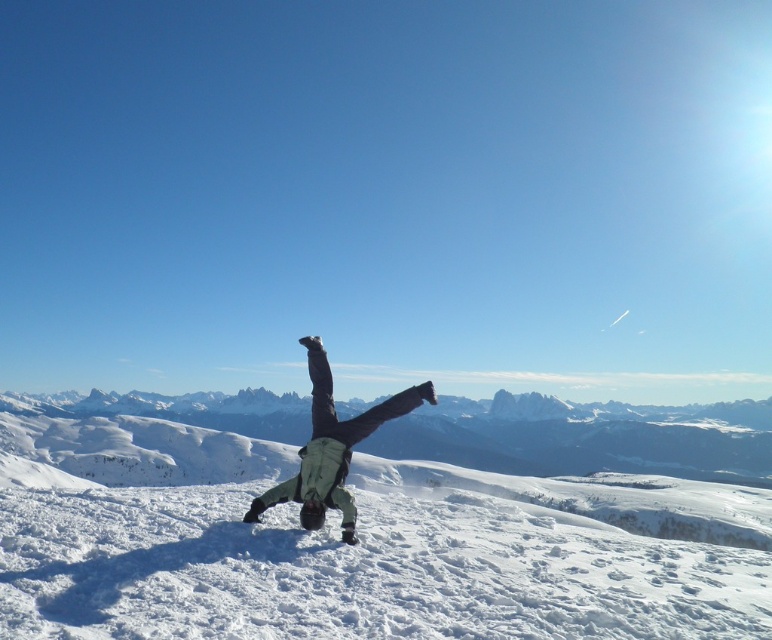
Does white powdery snow at center appear under light green fabric pants at center?

Yes, white powdery snow at center is below light green fabric pants at center.

Identify the location of white powdery snow at center. This screenshot has height=640, width=772. (357, 545).

Image resolution: width=772 pixels, height=640 pixels. Find the location of `white powdery snow at center`. white powdery snow at center is located at coordinates (357, 545).

The height and width of the screenshot is (640, 772). What are the coordinates of `white powdery snow at center` in the screenshot? It's located at (357, 545).

Who is positioned more to the left, white powdery snow at center or snowy mountain at center?

Positioned to the left is snowy mountain at center.

Is the position of white powdery snow at center more distant than that of snowy mountain at center?

That is False.

Who is more distant from viewer, (63, 557) or (608, 467)?

Point (608, 467)

Where is `white powdery snow at center`? This screenshot has width=772, height=640. white powdery snow at center is located at coordinates (357, 545).

This screenshot has height=640, width=772. I want to click on snowy mountain at center, so click(584, 436).

Can you confirm if snowy mountain at center is thinner than light green fabric pants at center?

In fact, snowy mountain at center might be wider than light green fabric pants at center.

Identify the location of snowy mountain at center. (584, 436).